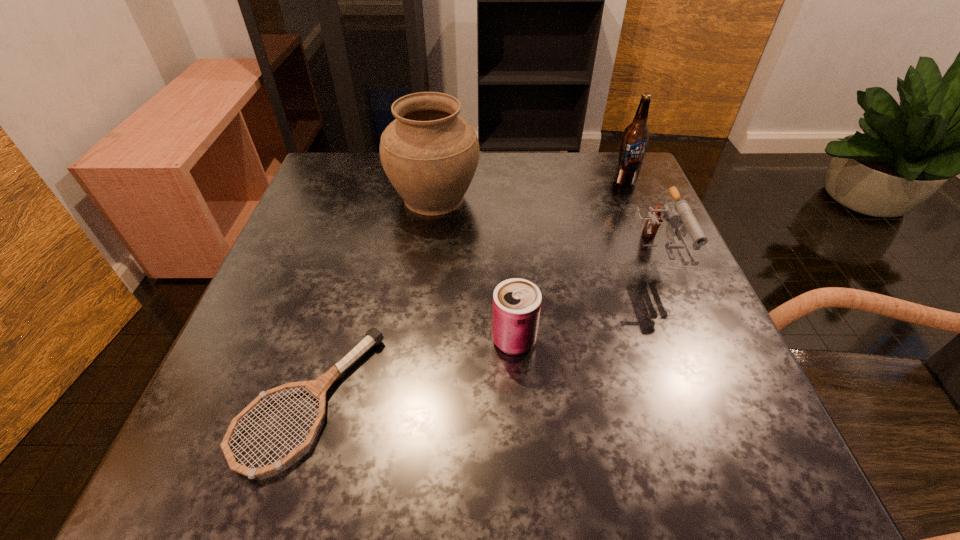
You are a GUI agent. You are given a task and a screenshot of the screen. Output one action in this format:
    pyautogui.click(x=<x>, y=<y>)
    Task: Click on the urn
    This screenshot has width=960, height=540.
    Given the screenshot: What is the action you would take?
    pyautogui.click(x=430, y=154)

Locate an element on the screen. beer bottle is located at coordinates (636, 135).

This screenshot has height=540, width=960. I want to click on gun, so click(x=672, y=214).

I want to click on the third tallest object, so pos(672,214).

The height and width of the screenshot is (540, 960). Identify the location of the third object from left to right. (516, 305).

At what (x,y) coordinates should I click in order to perform the action: click on can. Please return your answer as a coordinate pair (x, y). This screenshot has height=540, width=960. Looking at the image, I should click on (516, 305).

Image resolution: width=960 pixels, height=540 pixels. Find the location of `tennis racket`. tennis racket is located at coordinates (318, 387).

I want to click on vacant space located on the front of the urn, so click(412, 372).

The width and height of the screenshot is (960, 540). I want to click on free space located on the label of the beer bottle, so click(638, 215).

You are a GUI agent. You are given a task and a screenshot of the screen. Output one action in this format:
    pyautogui.click(x=<x>, y=<y>)
    Task: Click on the vacant region located 0.300m at the barrel end of the third nearest object
    The height and width of the screenshot is (540, 960).
    Given the screenshot: What is the action you would take?
    pyautogui.click(x=733, y=460)